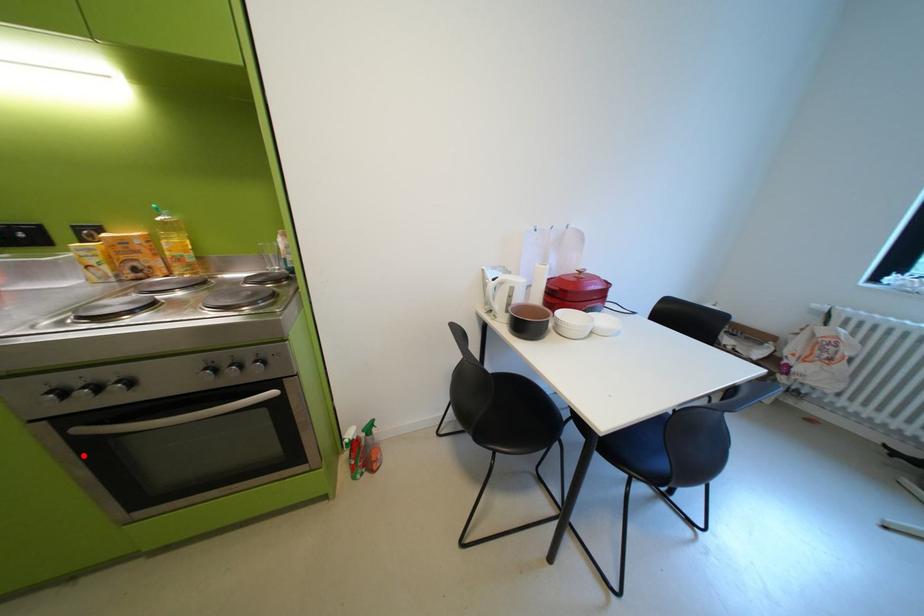
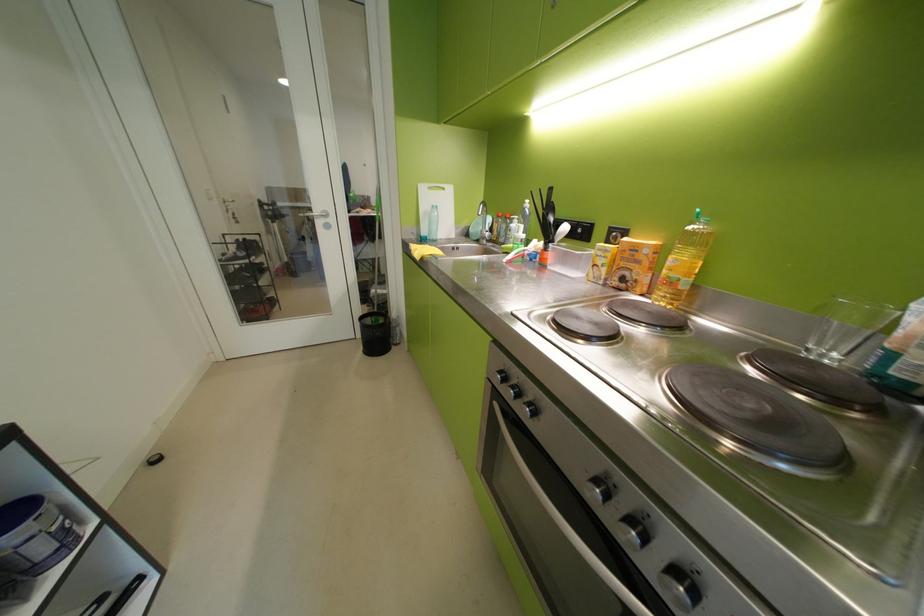
Locate, in the second image, the point that corresponds to the highlighted location in the first image.

(497, 416)